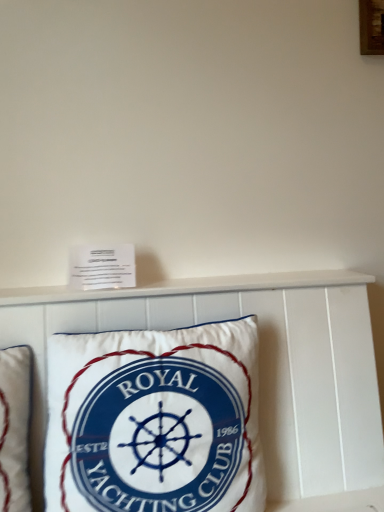
The width and height of the screenshot is (384, 512). Find the location of `white fabric pillow at center`. white fabric pillow at center is located at coordinates (259, 364).

This screenshot has height=512, width=384. What do you see at coordinates (259, 364) in the screenshot? I see `white fabric pillow at center` at bounding box center [259, 364].

Where is `white fabric pillow at center`? This screenshot has width=384, height=512. white fabric pillow at center is located at coordinates (259, 364).